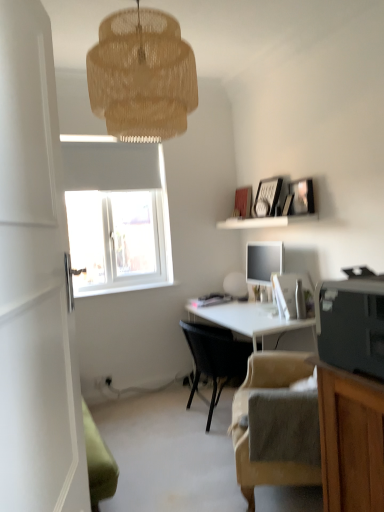
You are a GUI agent. You are given a task and a screenshot of the screen. Output one action in this format:
    pyautogui.click(x=<x>, y=<y>)
    Task: Click on the vacant space in front of black woven chair at center, the 1th chair in the back-to-front sequence
    This screenshot has height=512, width=384.
    Given the screenshot: What is the action you would take?
    pyautogui.click(x=193, y=453)